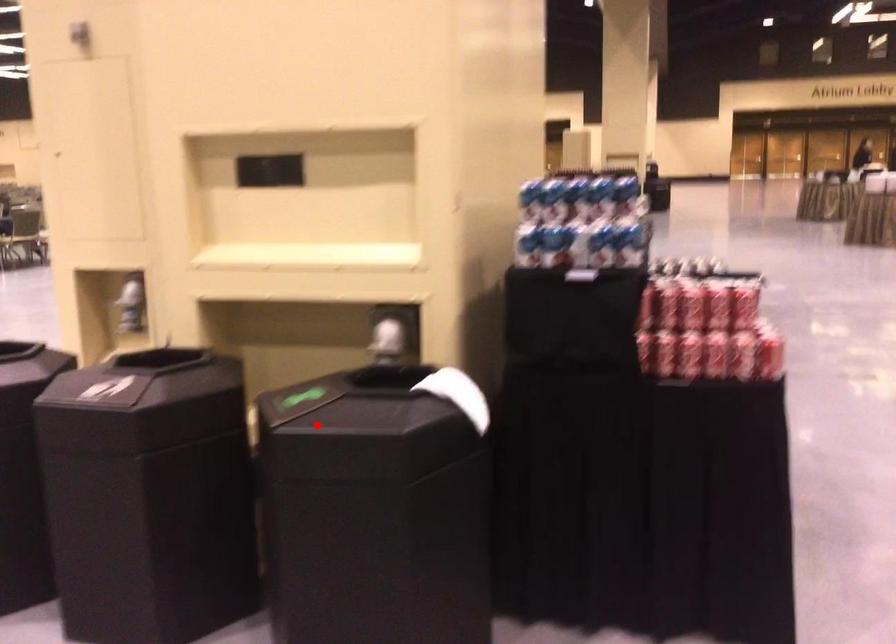
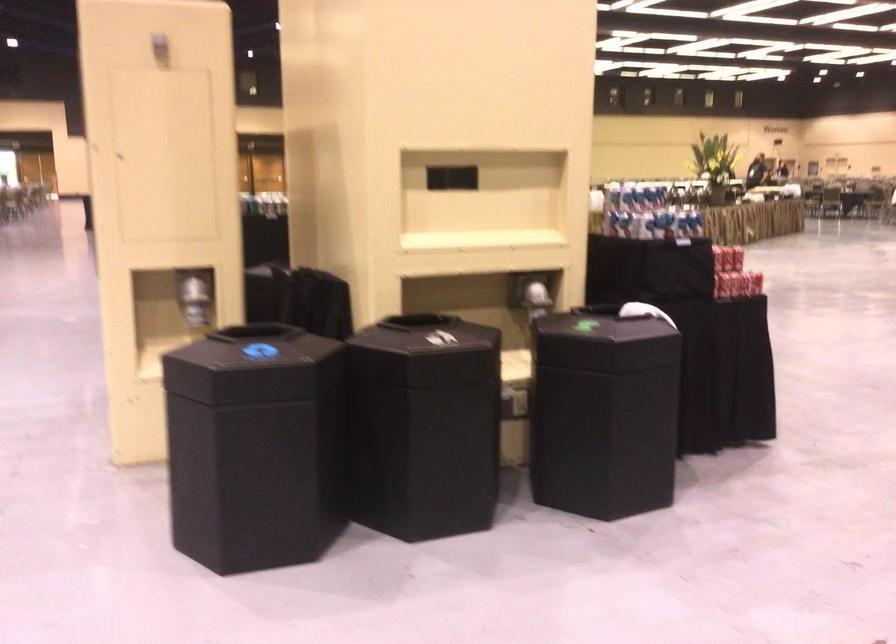
Find the pixel in the second image that matches the highlighted location in the first image.

(605, 341)